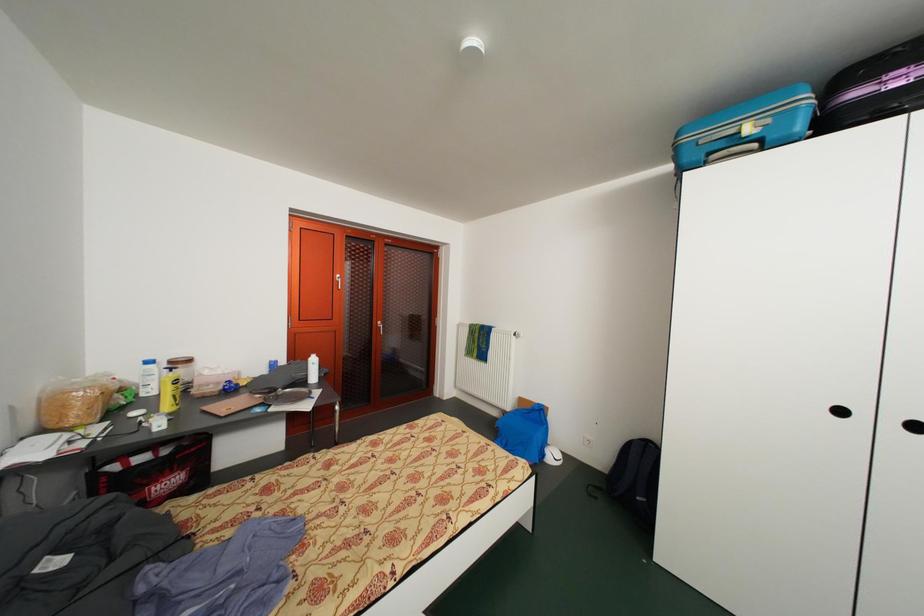
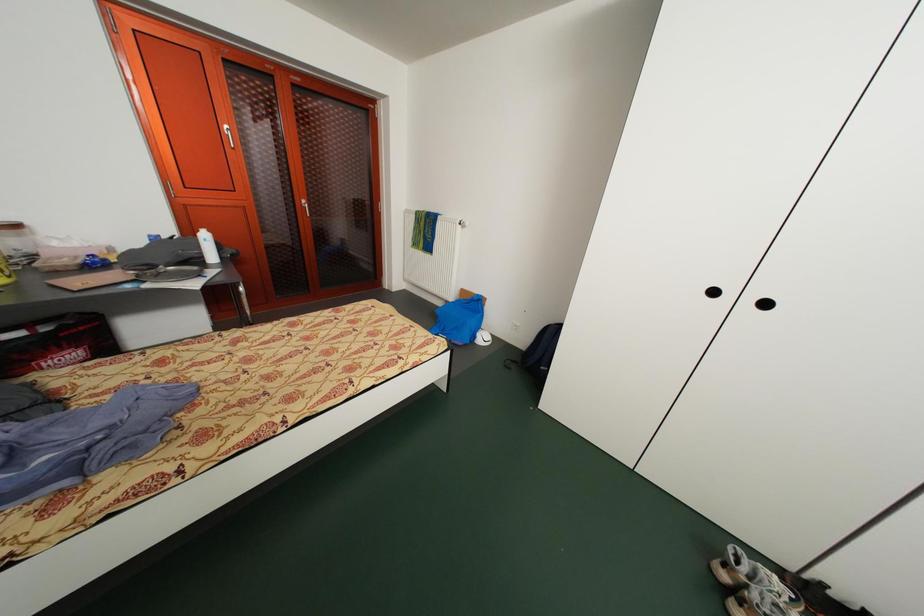
Question: The first image is from the beginning of the video and the second image is from the end. How did the camera likely rotate when shooting the video?

Choices:
 (A) Left
 (B) Right
 (C) Up
 (D) Down

Answer: (D)